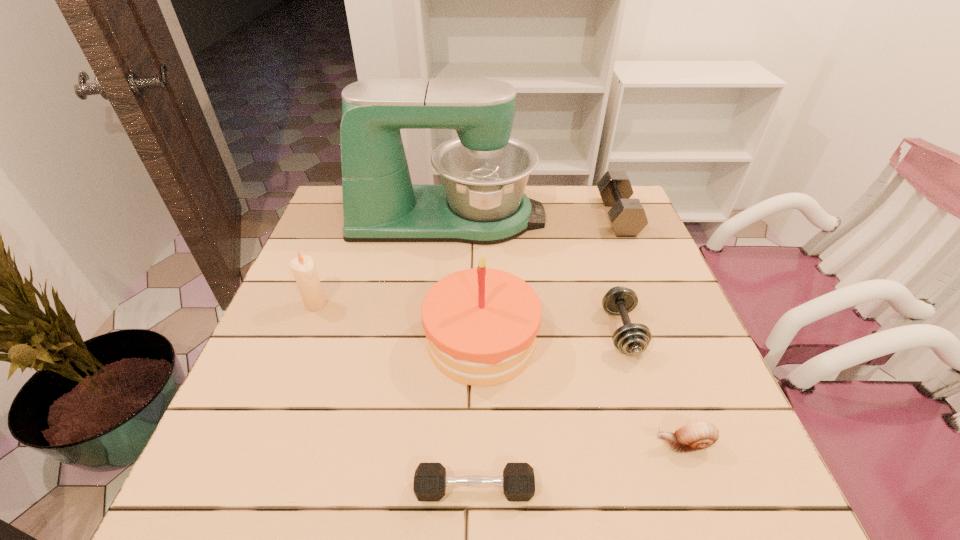
Locate an element on the screen. the shortest dumbbell is located at coordinates (430, 480).

Find the location of a particular element. Image resolution: width=960 pixels, height=540 pixels. free point located 0.210m on the front-facing side of the mixer is located at coordinates (613, 218).

The image size is (960, 540). In order to click on vacant space located 0.060m on the back of the birthday cake in this screenshot , I will do `click(481, 285)`.

Image resolution: width=960 pixels, height=540 pixels. Find the location of `free space located 0.070m on the right of the fifth shortest object`. free space located 0.070m on the right of the fifth shortest object is located at coordinates (355, 304).

Find the location of a particular element. vacant region located on the front of the fourth tallest object is located at coordinates (636, 260).

Locate an element on the screen. The width and height of the screenshot is (960, 540). free location located 0.230m on the front of the fifth tallest object is located at coordinates (667, 474).

At what (x,y) coordinates should I click in order to perform the action: click on vacant area situated on the front-facing side of the sixth farthest object. Please return your answer as a coordinate pair (x, y). Looking at the image, I should click on (455, 444).

Identify the location of vacant space situated on the front-facing side of the sixth farthest object. The width and height of the screenshot is (960, 540). (625, 444).

Where is `free space located 0.130m on the front-facing side of the sixth farthest object`? The image size is (960, 540). free space located 0.130m on the front-facing side of the sixth farthest object is located at coordinates pos(582,444).

I want to click on free space located on the right of the nearest dumbbell, so click(580, 489).